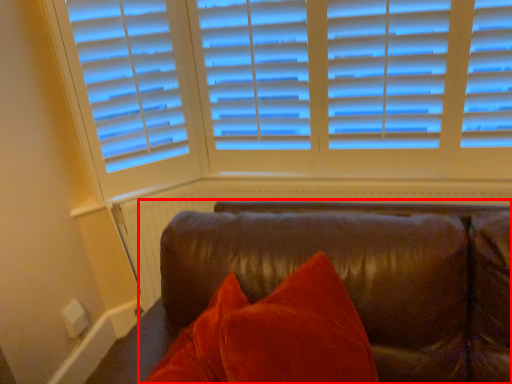
Question: From the image's perspective, what is the correct spatial relationship of studio couch (annotated by the red box) in relation to radiator?

Choices:
 (A) above
 (B) below

Answer: (B)